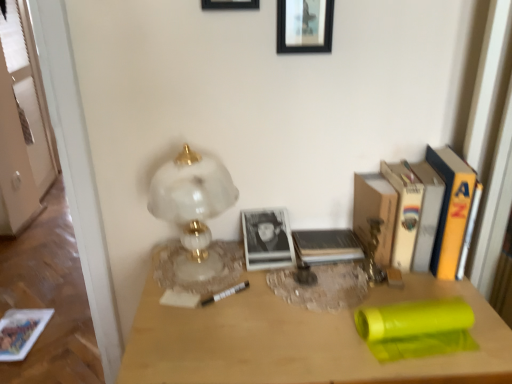
Where is `vacant point above matte paper book at lower left (from a real-world perspective)`? vacant point above matte paper book at lower left (from a real-world perspective) is located at coordinates point(16,326).